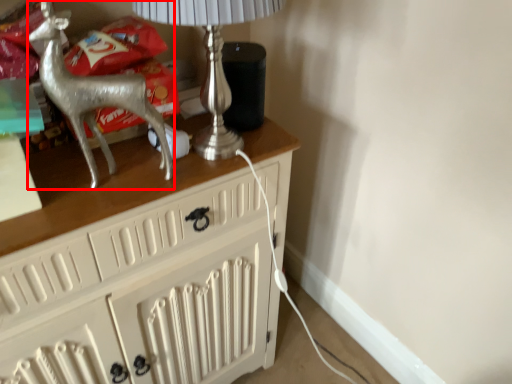
Question: Considering the relative positions of reindeer (annotated by the red box) and table lamp in the image provided, where is reindeer (annotated by the red box) located with respect to the staircase?

Choices:
 (A) right
 (B) left

Answer: (B)